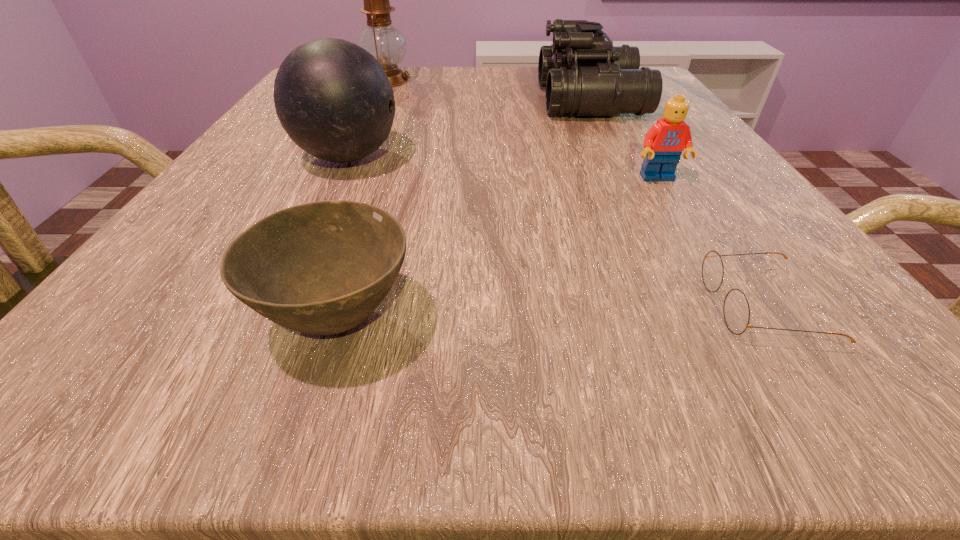
At what (x,y) coordinates should I click in order to perform the action: click on oil lamp. Please return your answer as a coordinate pair (x, y). This screenshot has width=960, height=540. Looking at the image, I should click on (386, 43).

You are a GUI agent. You are given a task and a screenshot of the screen. Output one action in this format:
    pyautogui.click(x=<x>, y=<y>)
    Task: Click on the fifth shortest object
    The height and width of the screenshot is (540, 960).
    Given the screenshot: What is the action you would take?
    pyautogui.click(x=334, y=100)

Where is `binoculars`? binoculars is located at coordinates (584, 74).

I want to click on Lego, so click(664, 142).

You are a GUI agent. You are given a task and a screenshot of the screen. Output one action in this format:
    pyautogui.click(x=<x>, y=<y>)
    Task: Click on the bowl
    The image size is (960, 540).
    Given the screenshot: What is the action you would take?
    pyautogui.click(x=321, y=268)

Locate an element on the screen. the shortest object is located at coordinates (736, 310).

Where is `vacant space situated on the right of the oil lamp`? This screenshot has height=540, width=960. vacant space situated on the right of the oil lamp is located at coordinates (493, 80).

Identify the location of free space located 0.300m on the grip area of the second tallest object. The height and width of the screenshot is (540, 960). (591, 157).

Find the location of a particular element. The image size is (960, 540). vacant space situated 0.240m through the lenses of the binoculars is located at coordinates (421, 100).

Identify the location of free space located 0.090m through the lenses of the binoculars. The width and height of the screenshot is (960, 540). (496, 100).